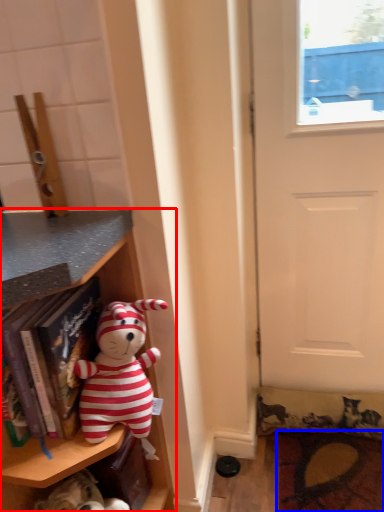
Question: Among these objects, which one is nearest to the camera, shelf (highlighted by a red box) or doormat (highlighted by a blue box)?

Choices:
 (A) shelf
 (B) doormat

Answer: (A)